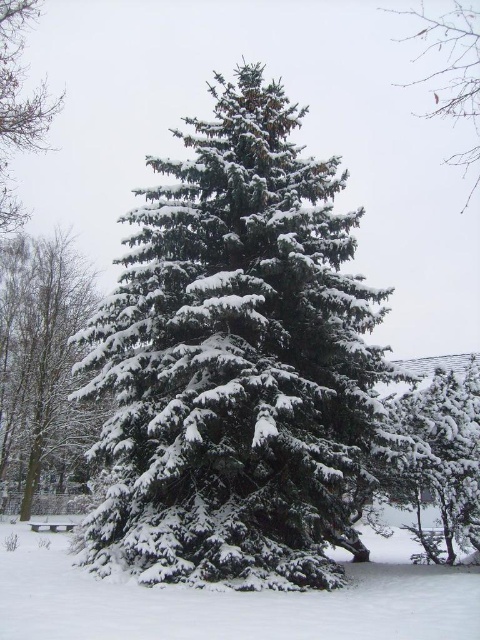
You are a GUI agent. You are given a task and a screenshot of the screen. Output one action in this format:
    pyautogui.click(x=<x>, y=<y>)
    Task: Click on the green matte fir tree at center
    The height and width of the screenshot is (640, 480).
    Given the screenshot: What is the action you would take?
    pyautogui.click(x=239, y=364)

Does green matte fir tree at center appear on the right side of green matte tree at upper left?

Yes, green matte fir tree at center is to the right of green matte tree at upper left.

Find the location of a particular element. green matte fir tree at center is located at coordinates pyautogui.click(x=239, y=364).

The height and width of the screenshot is (640, 480). Identify the location of green matte fir tree at center. (239, 364).

Who is shorter, white fluffy snow at center or snow-covered tree at left?

With less height is white fluffy snow at center.

Which is below, white fluffy snow at center or snow-covered tree at left?

white fluffy snow at center is lower down.

Is point (204, 616) closer to viewer compared to point (67, 362)?

Yes, point (204, 616) is closer to viewer.

Locate an element on the screen. The image size is (480, 640). white fluffy snow at center is located at coordinates (232, 600).

Is green matte fir tree at center taller than white fluffy snow at center?

Indeed, green matte fir tree at center has a greater height compared to white fluffy snow at center.

Measure the distance between green matte fir tree at center and white fluffy snow at center.

green matte fir tree at center is 4.07 meters from white fluffy snow at center.

Who is more forward, [162,390] or [410,582]?

Point [410,582] is in front.

Image resolution: width=480 pixels, height=640 pixels. I want to click on green matte fir tree at center, so click(x=239, y=364).